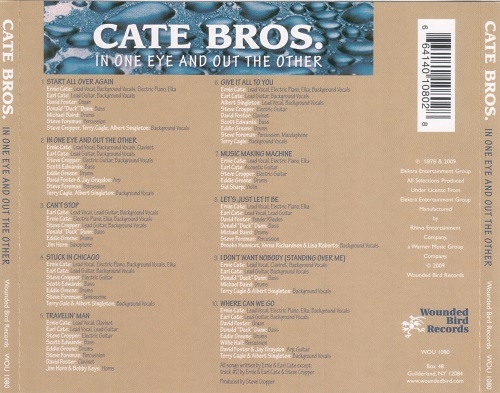
Locate an element on the screen. This screenshot has height=393, width=500. album is located at coordinates (140, 188).